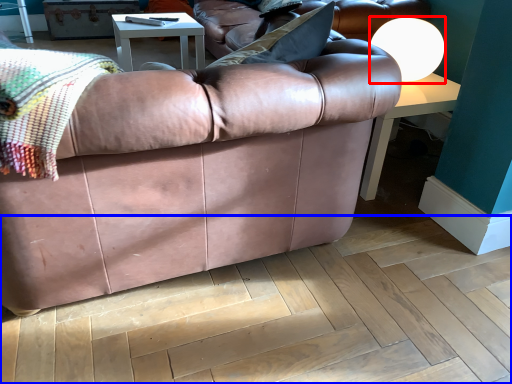
Question: Which point is closer to the camera, lamp (highlighted by a red box) or plywood (highlighted by a blue box)?

Choices:
 (A) lamp
 (B) plywood

Answer: (B)